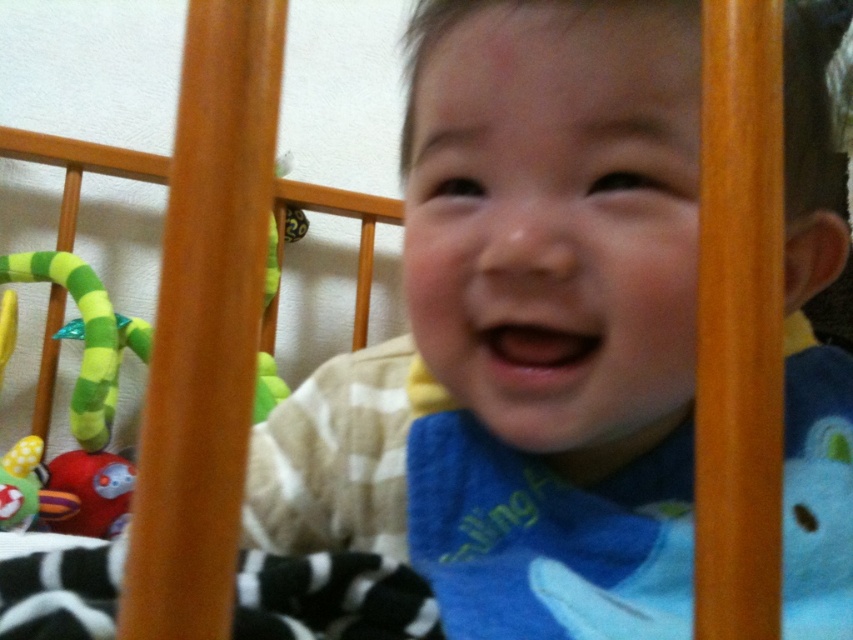
Does red plush toy at left have a larger size compared to rubberized green and yellow toy at left?

Indeed, red plush toy at left has a larger size compared to rubberized green and yellow toy at left.

Who is higher up, red plush toy at left or rubberized green and yellow toy at left?

rubberized green and yellow toy at left is higher up.

Does point (132, 481) come farther from viewer compared to point (18, 502)?

Yes, point (132, 481) is farther from viewer.

Locate an element on the screen. This screenshot has height=640, width=853. red plush toy at left is located at coordinates (91, 492).